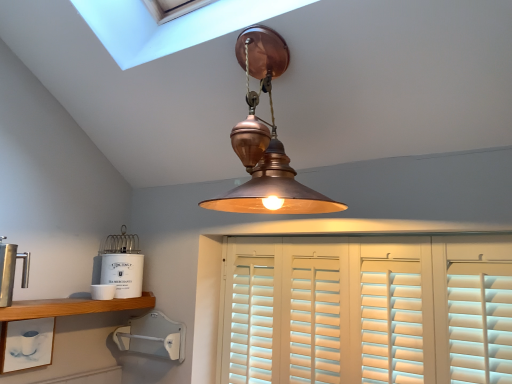
Question: In terms of height, does white matte cup at lower left, placed as the 1th shelf when sorted from bottom to top, look taller or shorter compared to white matte tea canister at left, which is counted as the 2th appliance, starting from the top?

Choices:
 (A) short
 (B) tall

Answer: (B)

Question: Is white matte cup at lower left, the 2th shelf in the top-to-bottom sequence, spatially inside white matte tea canister at left, which is counted as the 2th appliance, starting from the top, or outside of it?

Choices:
 (A) inside
 (B) outside

Answer: (B)

Question: Which of these objects is positioned farthest from the copper pendant light at center?

Choices:
 (A) white matte cup at lower left, placed as the 1th shelf when sorted from bottom to top
 (B) polished stainless steel coffee press at left, which ranks as the fourth appliance in bottom-to-top order
 (C) white plastic wall mount at lower left, the 4th appliance viewed from the top
 (D) white ceramic container at lower left, which appears as the second appliance when ordered from the bottom
 (E) wooden shelf at lower left, the 1th shelf positioned from the top

Answer: (A)

Question: Which object is positioned farthest from the white matte cup at lower left, placed as the 1th shelf when sorted from bottom to top?

Choices:
 (A) white plastic wall mount at lower left, the 4th appliance viewed from the top
 (B) wooden shelf at lower left, the 1th shelf positioned from the top
 (C) white wood shutters at center
 (D) polished stainless steel coffee press at left, which ranks as the fourth appliance in bottom-to-top order
 (E) copper pendant light at center

Answer: (E)